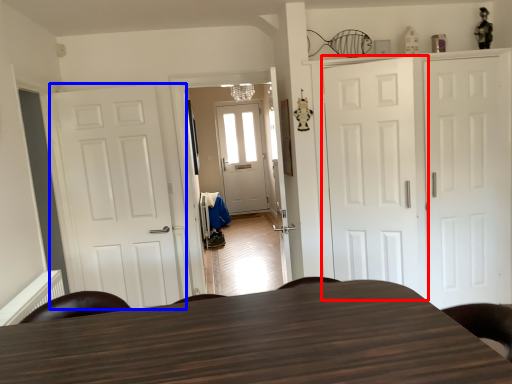
Question: Which of the following is the farthest to the observer, door (highlighted by a red box) or door (highlighted by a blue box)?

Choices:
 (A) door
 (B) door

Answer: (B)